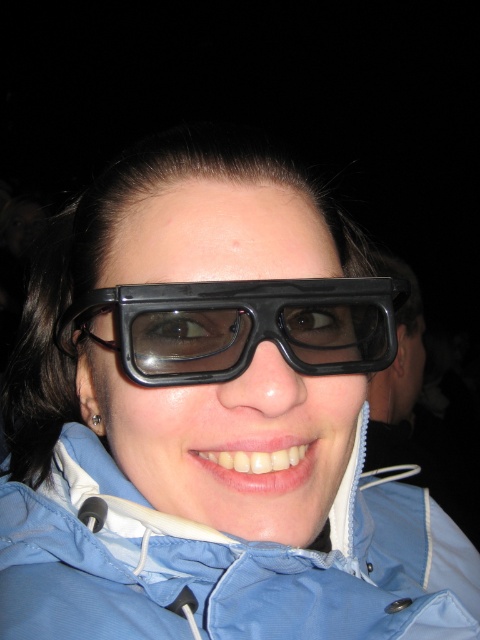
Is blue fabric jacket at lower center above black plastic goggles at center?

Actually, blue fabric jacket at lower center is below black plastic goggles at center.

Who is lower down, blue fabric jacket at lower center or black plastic goggles at center?

blue fabric jacket at lower center is below.

Which is behind, point (128, 604) or point (278, 330)?

The point (128, 604) is more distant.

At what (x,y) coordinates should I click in order to perform the action: click on blue fabric jacket at lower center. Please return your answer as a coordinate pair (x, y). This screenshot has width=480, height=640. Looking at the image, I should click on (227, 563).